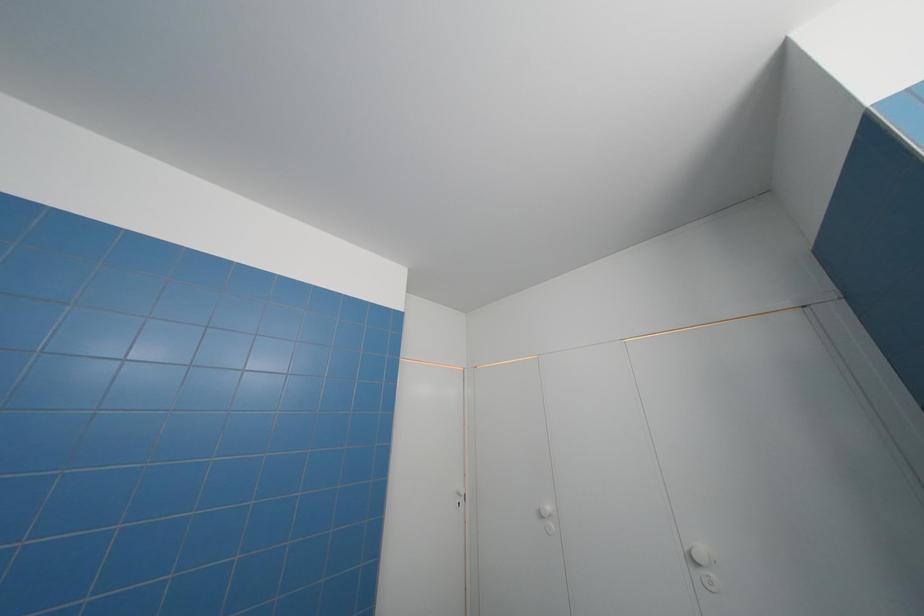
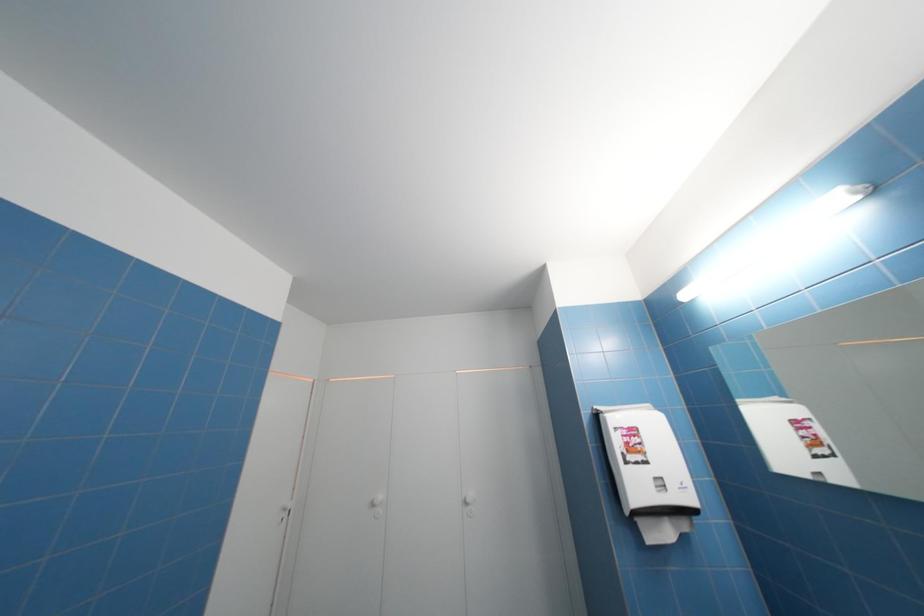
Question: The camera is either moving clockwise (left) or counter-clockwise (right) around the object. The first image is from the beginning of the video and the second image is from the end. Is the camera moving left or right when shooting the video?

Choices:
 (A) Left
 (B) Right

Answer: (A)